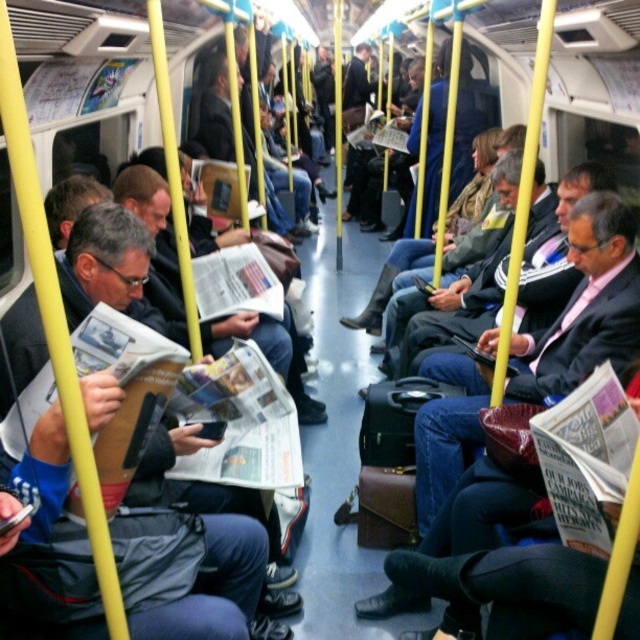
You are standing inside the subway train and want to reach a point closer to you. There are two points marked in the scene, point (x=429, y=376) and point (x=172, y=259). Which point should you head towards?

Point (x=429, y=376) is closer to the viewer than point (x=172, y=259), so you should head towards point (x=429, y=376).

Based on the photo, you are a passenger on the subway train and you want to know if the matte black jacket at left is positioned lower than the dark blue suit at center. Can you determine this based on the scene?

The matte black jacket at left is located below the dark blue suit at center, so yes, it is positioned lower than the dark blue suit at center.